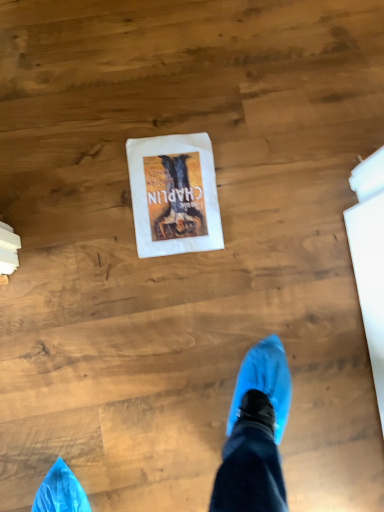
What are the coordinates of `free space above white paper at center (from a real-world perspective)` in the screenshot? It's located at (174, 194).